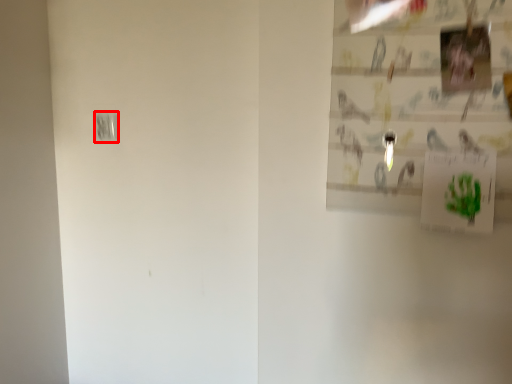
Question: In this image, where is light switch (annotated by the red box) located relative to postcard?

Choices:
 (A) left
 (B) right

Answer: (A)